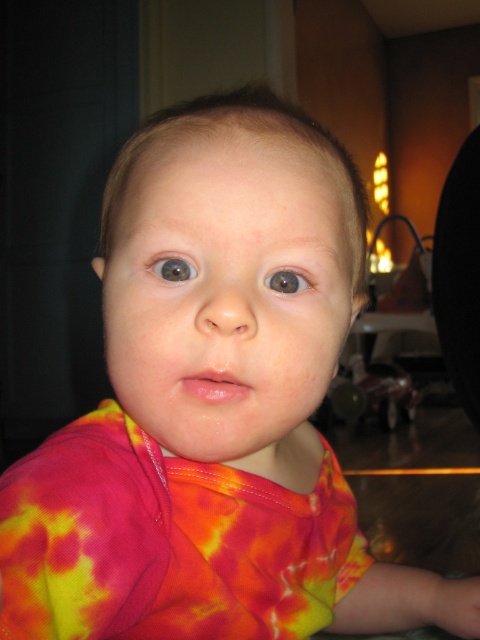
Looking at this image, you are a photographer trying to capture the perfect shot of the child in the image. You notice two points marked in the scene. Which point is closer to the camera, point (x=189, y=262) or point (x=286, y=292)?

Point (x=189, y=262) is in front of point (x=286, y=292), so it is closer to the camera.

You are a photographer capturing a child in a domestic setting. You notice the blue glossy eye at center and the brown matte eye at center. Which eye is positioned to the left?

The blue glossy eye at center is positioned to the left of the brown matte eye at center.